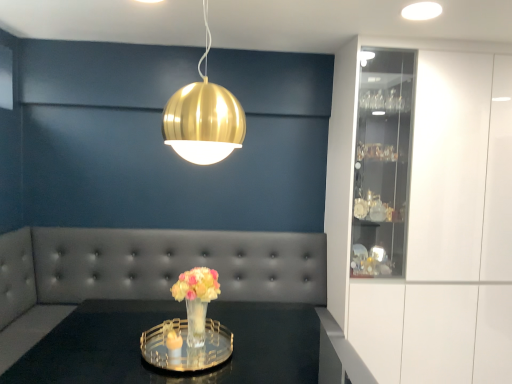
Question: Is translucent glass vase at center at the back of clear glass tray at center?

Choices:
 (A) yes
 (B) no

Answer: (B)

Question: Can you confirm if clear glass tray at center is wider than translucent glass vase at center?

Choices:
 (A) no
 (B) yes

Answer: (B)

Question: Does clear glass tray at center have a lesser height compared to translucent glass vase at center?

Choices:
 (A) no
 (B) yes

Answer: (A)

Question: Can you confirm if clear glass tray at center is positioned to the right of translucent glass vase at center?

Choices:
 (A) yes
 (B) no

Answer: (B)

Question: Does clear glass tray at center appear on the left side of translucent glass vase at center?

Choices:
 (A) yes
 (B) no

Answer: (A)

Question: From a real-world perspective, is clear glass tray at center over translucent glass vase at center?

Choices:
 (A) yes
 (B) no

Answer: (B)

Question: From a real-world perspective, does tufted leather couch at center stand above gold metallic sphere at upper center?

Choices:
 (A) no
 (B) yes

Answer: (A)

Question: Can you confirm if tufted leather couch at center is thinner than gold metallic sphere at upper center?

Choices:
 (A) yes
 (B) no

Answer: (B)

Question: Is tufted leather couch at center positioned in front of gold metallic sphere at upper center?

Choices:
 (A) no
 (B) yes

Answer: (A)

Question: Is tufted leather couch at center oriented away from gold metallic sphere at upper center?

Choices:
 (A) no
 (B) yes

Answer: (A)

Question: From the image's perspective, is tufted leather couch at center under gold metallic sphere at upper center?

Choices:
 (A) yes
 (B) no

Answer: (A)

Question: Does tufted leather couch at center have a greater height compared to gold metallic sphere at upper center?

Choices:
 (A) yes
 (B) no

Answer: (A)

Question: Can you confirm if clear glass tray at center is smaller than tufted leather couch at center?

Choices:
 (A) no
 (B) yes

Answer: (B)